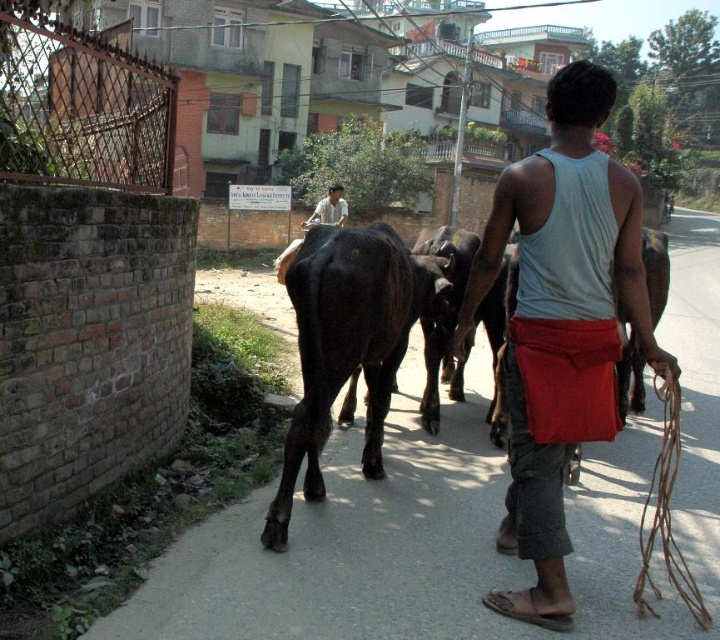
Question: Can you confirm if gray cotton tank top at center is thinner than black glossy bull at center?

Choices:
 (A) yes
 (B) no

Answer: (A)

Question: Among these objects, which one is farthest from the camera?

Choices:
 (A) light brown shirt at upper center
 (B) black glossy bull at center

Answer: (A)

Question: Does gray cotton tank top at center come in front of black glossy bull at center?

Choices:
 (A) yes
 (B) no

Answer: (A)

Question: Is black glossy bull at center to the left of light brown shirt at upper center from the viewer's perspective?

Choices:
 (A) no
 (B) yes

Answer: (A)

Question: Estimate the real-world distances between objects in this image. Which object is closer to the gray cotton tank top at center?

Choices:
 (A) light brown shirt at upper center
 (B) black glossy bull at center

Answer: (B)

Question: Which point is farther to the camera?

Choices:
 (A) black glossy bull at center
 (B) gray cotton tank top at center
 (C) light brown shirt at upper center

Answer: (C)